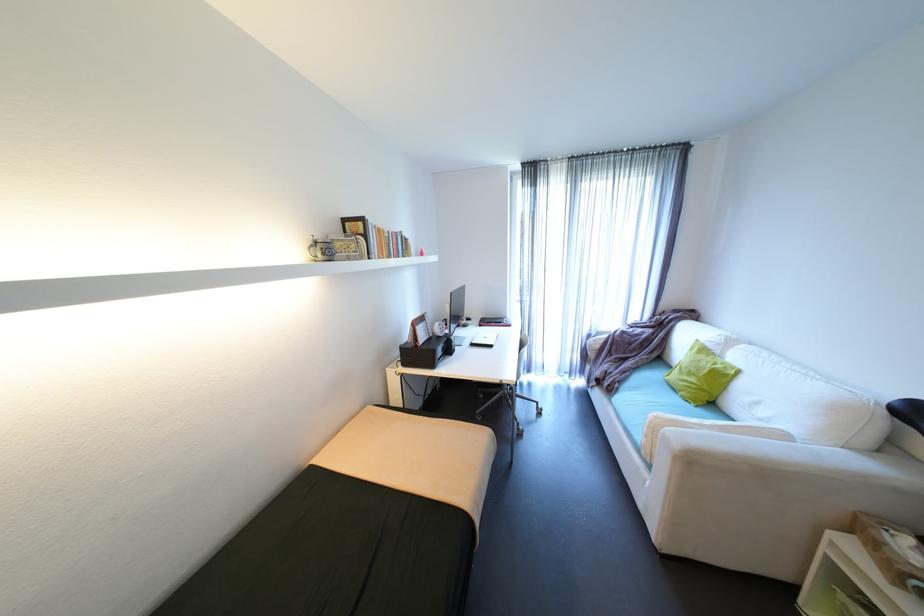
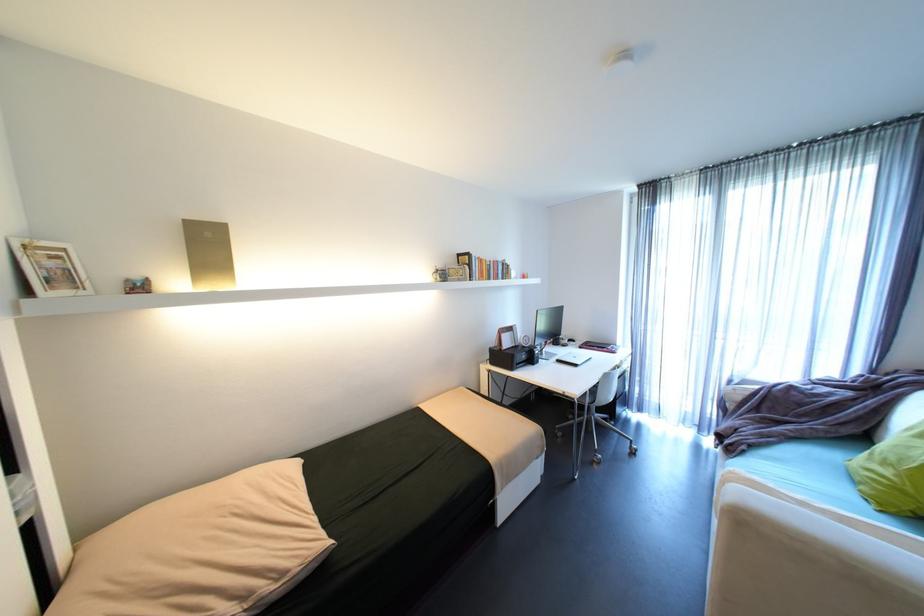
The point at (671, 430) is marked in the first image. Where is the corresponding point in the second image?

(737, 485)